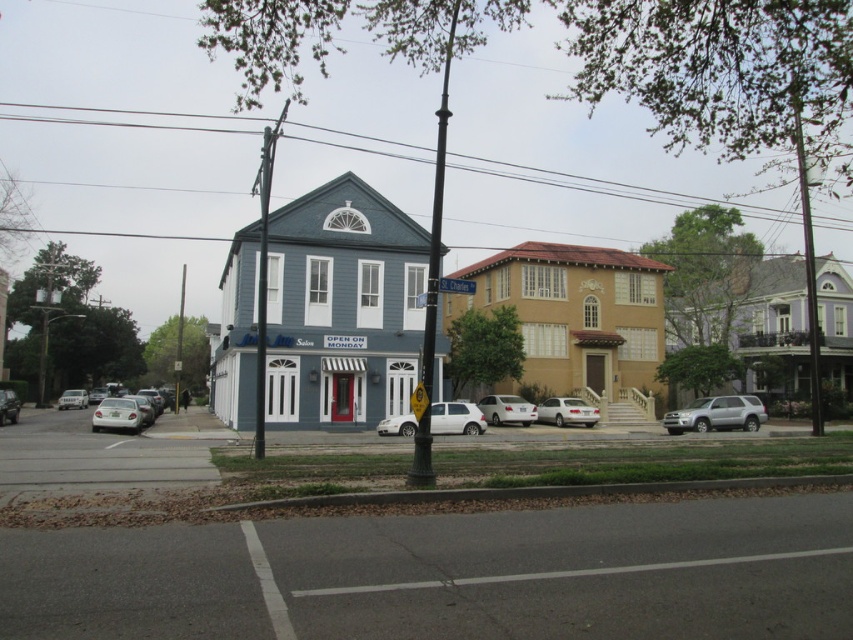
From the picture: You are standing on the sidewalk in the residential area and notice a white matte car at center. Based on its position, can you determine if it is parked legally according to standard parking regulations that require vehicles to be at least 30 cm away from the curb?

The white matte car at center is located at point coordinates that do not provide specific distance measurements from the curb. Without exact distance information, it is impossible to determine if it meets the 30 cm requirement.

You are a pedestrian standing on the sidewalk in the image. You see a white matte car at lower left and a metallic silver sedan at lower left. Which car is closer to the road edge marked by the white line?

The metallic silver sedan at lower left is closer to the road edge marked by the white line because the white matte car at lower left is to the right of it, meaning the silver sedan is positioned nearer to the edge.

You are a delivery person trying to determine which vehicle to park closer to the curb. The white matte car at lower left and the metallic silver sedan at lower left are both available. Which vehicle should you choose if you want to park in a space that requires the vehicle to be lower to the ground?

The white matte car at lower left has a lesser height compared to the metallic silver sedan at lower left, so you should choose the white matte car at lower left because it is lower to the ground and better suited for the parking space.